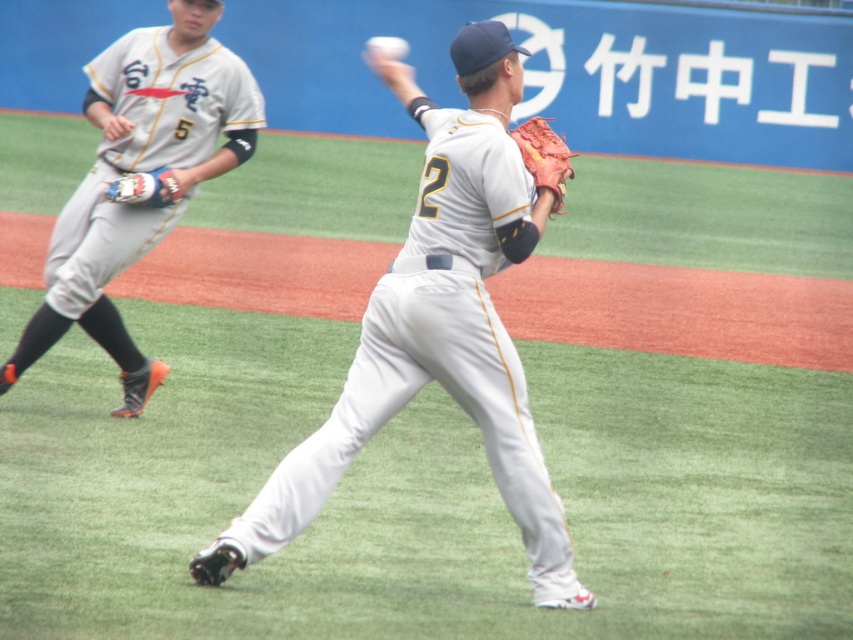
Question: Does white matte baseball glove at upper center appear on the left side of leather glove at left?

Choices:
 (A) yes
 (B) no

Answer: (A)

Question: Which point appears farthest from the camera in this image?

Choices:
 (A) (560, 182)
 (B) (500, 147)
 (C) (399, 45)

Answer: (C)

Question: Can you confirm if white matte baseball glove at upper center is smaller than leather glove at left?

Choices:
 (A) yes
 (B) no

Answer: (B)

Question: Which of the following is the farthest from the observer?

Choices:
 (A) (177, 193)
 (B) (520, 500)
 (C) (102, 80)

Answer: (C)

Question: Can you confirm if leather textured glove at center is positioned to the right of leather glove at left?

Choices:
 (A) yes
 (B) no

Answer: (A)

Question: Which object is positioned closest to the leather textured glove at center?

Choices:
 (A) white matte baseball glove at upper center
 (B) leather glove at left

Answer: (B)